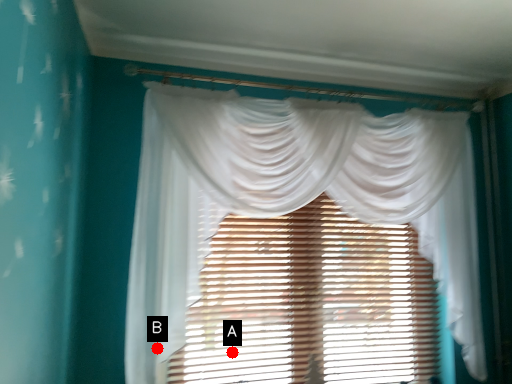
Question: Two points are circled on the image, labeled by A and B beside each circle. Which point is further to the camera?

Choices:
 (A) A is further
 (B) B is further

Answer: (A)